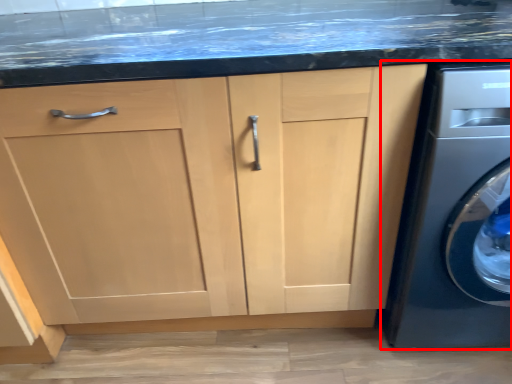
Question: Observing the image, what is the correct spatial positioning of washing machine (annotated by the red box) in reference to cabinetry?

Choices:
 (A) right
 (B) left

Answer: (A)